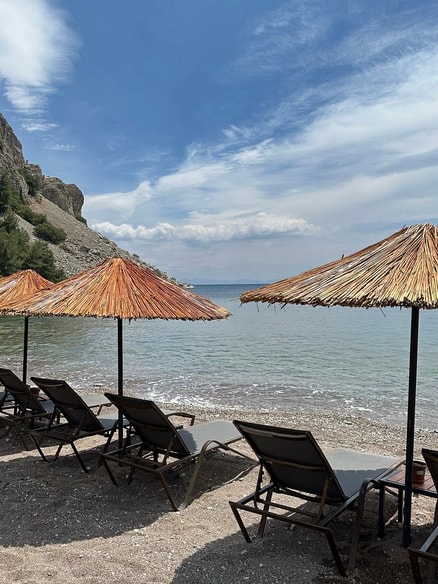
Locate an element on the screen. Image resolution: width=438 pixels, height=584 pixels. cup is located at coordinates (417, 472).